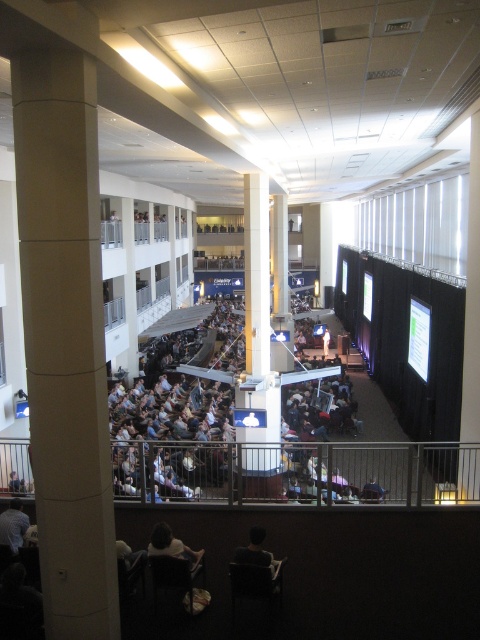
What do you see at coordinates (64, 337) in the screenshot?
I see `white concrete column at center` at bounding box center [64, 337].

Can you confirm if white concrete column at center is positioned to the left of dark brown hair at lower center?

Yes, white concrete column at center is to the left of dark brown hair at lower center.

Is point (84, 211) positioned behind point (178, 544)?

No, (84, 211) is in front of (178, 544).

Locate an element on the screen. white concrete column at center is located at coordinates (64, 337).

Does dark gray fabric crowd at center have a greater width compared to dark brown hair at lower center?

Yes, dark gray fabric crowd at center is wider than dark brown hair at lower center.

Can you confirm if dark gray fabric crowd at center is shorter than dark brown hair at lower center?

No.

Which is behind, point (112, 468) or point (156, 538)?

Point (112, 468)

Find the location of a particular element. dark gray fabric crowd at center is located at coordinates (172, 436).

Looking at this image, does dark brown hair at lower center appear on the right side of dark brown leather chair at lower center?

In fact, dark brown hair at lower center is to the left of dark brown leather chair at lower center.

Which is behind, point (165, 552) or point (249, 541)?

The point (249, 541) is behind.

Locate an element on the screen. Image resolution: width=480 pixels, height=640 pixels. dark brown hair at lower center is located at coordinates (171, 545).